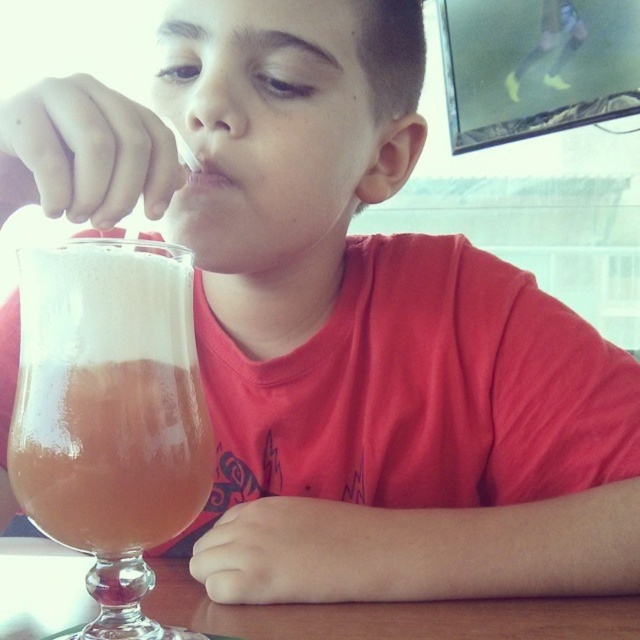
Is point (88, 371) farther from viewer compared to point (484, 636)?

No, it is not.

Is translucent glass beverage at lower left thinner than wooden table at lower center?

Correct, translucent glass beverage at lower left's width is less than wooden table at lower center's.

This screenshot has width=640, height=640. I want to click on translucent glass beverage at lower left, so click(108, 396).